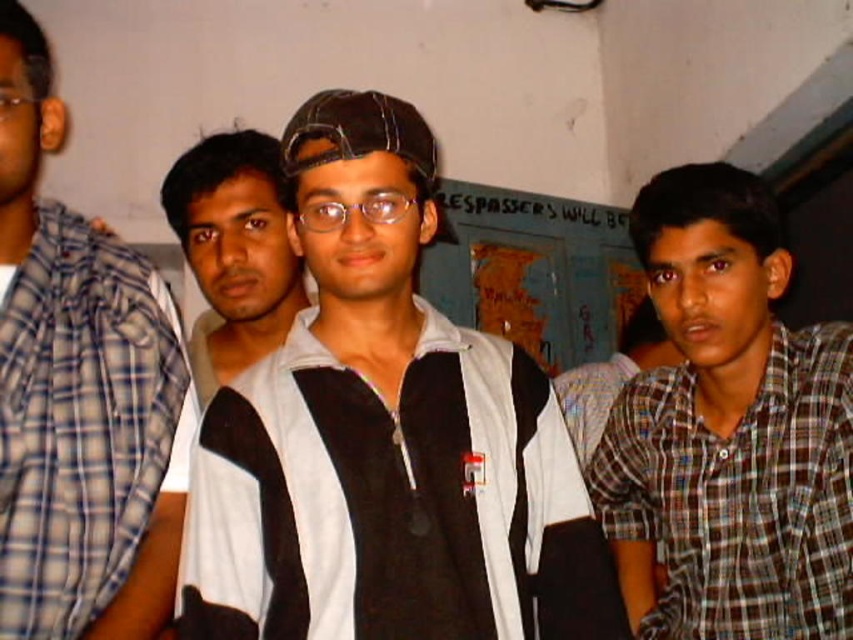
Is point (688, 573) positioned after point (280, 298)?

No, (688, 573) is in front of (280, 298).

Can you confirm if brown checkered shirt at right is wider than black and white striped shirt at center?

Yes, brown checkered shirt at right is wider than black and white striped shirt at center.

The width and height of the screenshot is (853, 640). Identify the location of brown checkered shirt at right. (728, 429).

Is white cotton shirt at left closer to camera compared to black and white striped shirt at center?

Yes, white cotton shirt at left is in front of black and white striped shirt at center.

Is white cotton shirt at left shorter than black and white striped shirt at center?

Incorrect, white cotton shirt at left's height does not fall short of black and white striped shirt at center's.

This screenshot has height=640, width=853. Identify the location of white cotton shirt at left. (79, 392).

Is black matte jacket at center above black and white striped shirt at center?

Actually, black matte jacket at center is below black and white striped shirt at center.

Which is above, black matte jacket at center or black and white striped shirt at center?

black and white striped shirt at center is higher up.

Is point (476, 442) closer to camera compared to point (204, 214)?

Yes.

Where is `black matte jacket at center`? This screenshot has height=640, width=853. black matte jacket at center is located at coordinates (386, 436).